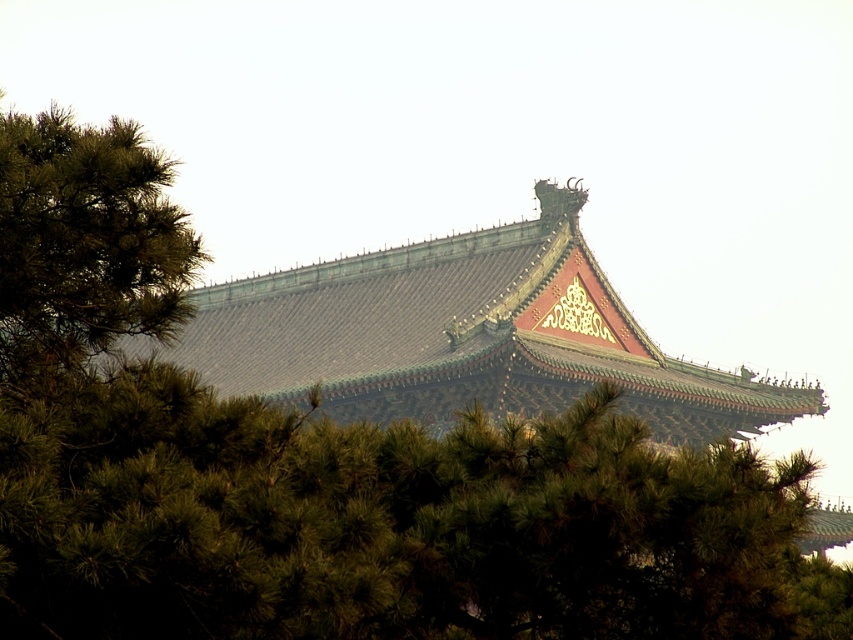
Question: Which point is closer to the camera?

Choices:
 (A) green leafy tree at left
 (B) green glazed tile roof at center
 (C) green matte pine tree at center

Answer: (C)

Question: In this image, where is green matte pine tree at center located relative to green leafy tree at left?

Choices:
 (A) left
 (B) right

Answer: (B)

Question: Which object appears farthest from the camera in this image?

Choices:
 (A) green glazed tile roof at center
 (B) green leafy tree at left
 (C) green matte pine tree at center

Answer: (A)

Question: Observing the image, what is the correct spatial positioning of green matte pine tree at center in reference to green leafy tree at left?

Choices:
 (A) below
 (B) above

Answer: (A)

Question: Among these points, which one is farthest from the camera?

Choices:
 (A) (181, 248)
 (B) (204, 548)
 (C) (593, 339)

Answer: (C)

Question: Is green matte pine tree at center to the right of green glazed tile roof at center from the viewer's perspective?

Choices:
 (A) yes
 (B) no

Answer: (B)